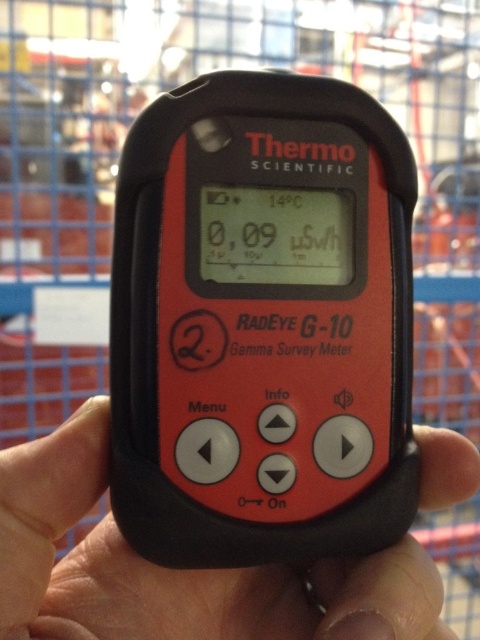
Which is in front, point (384, 198) or point (365, 586)?

Point (365, 586) is in front.

Who is shorter, matte black thermometer at center or black matte hand at center?

black matte hand at center is shorter.

What do you see at coordinates (262, 324) in the screenshot? I see `matte black thermometer at center` at bounding box center [262, 324].

Image resolution: width=480 pixels, height=640 pixels. In order to click on matte black thermometer at center in this screenshot , I will do `click(262, 324)`.